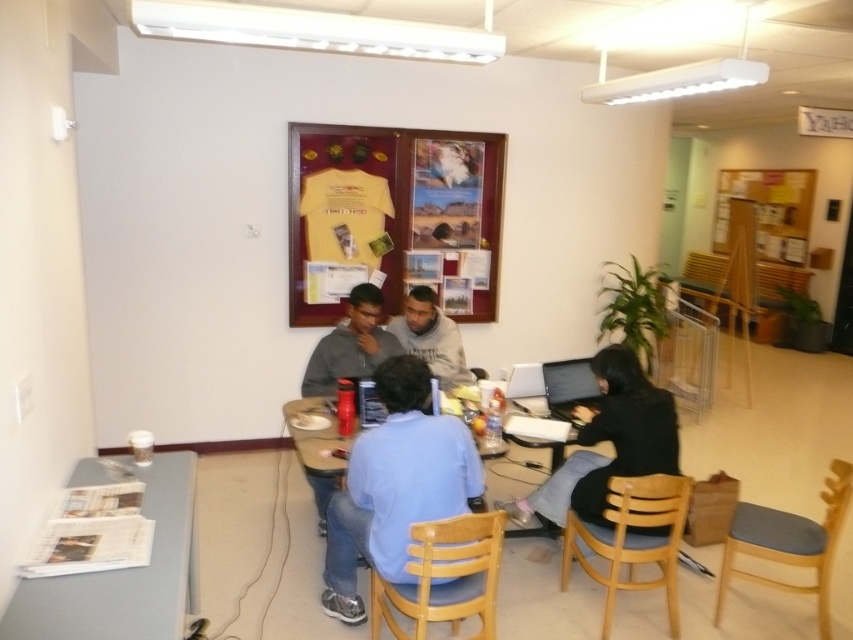
Can you confirm if black matte laptop at lower right is shorter than gray fleece jacket at center?

Incorrect, black matte laptop at lower right's height does not fall short of gray fleece jacket at center's.

Does black matte laptop at lower right have a smaller size compared to gray fleece jacket at center?

Actually, black matte laptop at lower right might be larger than gray fleece jacket at center.

Between point (625, 385) and point (380, 332), which one is positioned in front?

Point (625, 385) is in front.

Where is `black matte laptop at lower right`? This screenshot has width=853, height=640. black matte laptop at lower right is located at coordinates (608, 440).

Is blue cotton shirt at center thinner than wooden table at center?

Incorrect, blue cotton shirt at center's width is not less than wooden table at center's.

Does blue cotton shirt at center appear on the left side of wooden table at center?

In fact, blue cotton shirt at center is to the right of wooden table at center.

Which is behind, point (393, 472) or point (286, 406)?

Positioned behind is point (286, 406).

Locate an element on the screen. This screenshot has width=853, height=640. blue cotton shirt at center is located at coordinates (395, 484).

Identify the location of blue cotton shirt at center. (395, 484).

Is blue cotton shirt at center bigger than black matte laptop at lower right?

No.

Is point (376, 547) in front of point (606, 381)?

Yes.

At what (x,y) coordinates should I click in order to perform the action: click on blue cotton shirt at center. Please return your answer as a coordinate pair (x, y). This screenshot has height=640, width=853. Looking at the image, I should click on (395, 484).